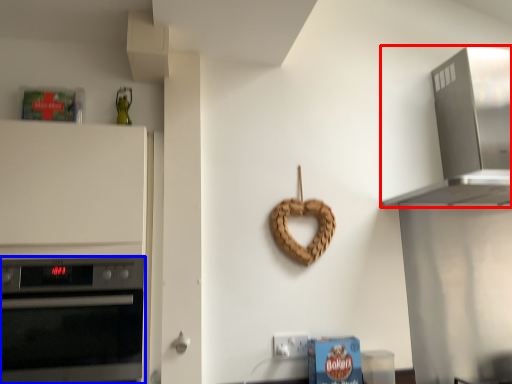
Question: Which object is closer to the camera taking this photo, home appliance (highlighted by a red box) or oven (highlighted by a blue box)?

Choices:
 (A) home appliance
 (B) oven

Answer: (B)